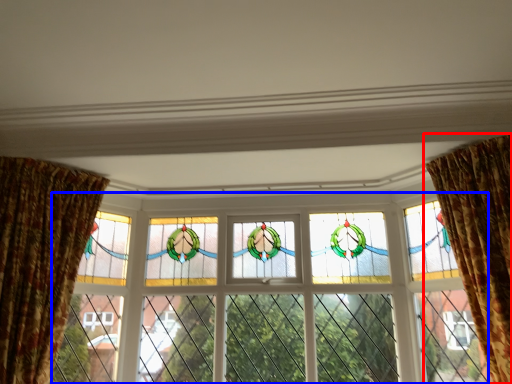
Question: Which point is further to the camera, curtain (highlighted by a red box) or window (highlighted by a blue box)?

Choices:
 (A) curtain
 (B) window

Answer: (B)